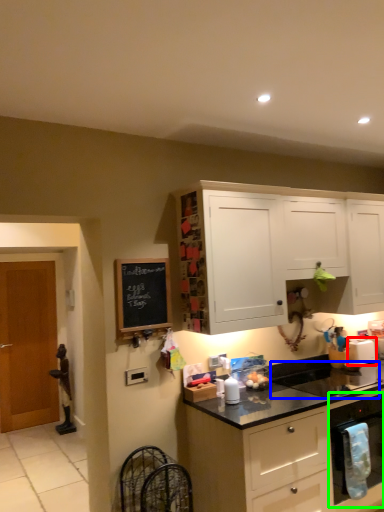
Question: Considering the real-world distances, which object is farthest from appliance (highlighted by a red box)? sink (highlighted by a blue box) or kitchen appliance (highlighted by a green box)?

Choices:
 (A) sink
 (B) kitchen appliance

Answer: (B)